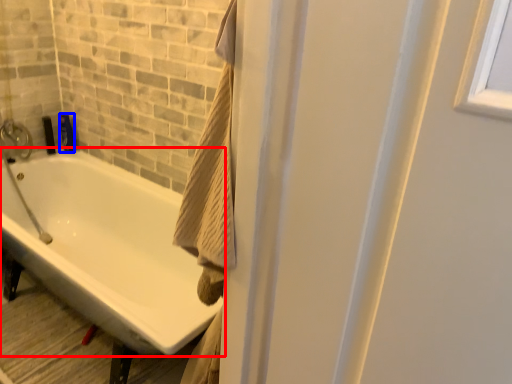
Question: Among these objects, which one is farthest to the camera, bathtub (highlighted by a red box) or toiletry (highlighted by a blue box)?

Choices:
 (A) bathtub
 (B) toiletry

Answer: (B)